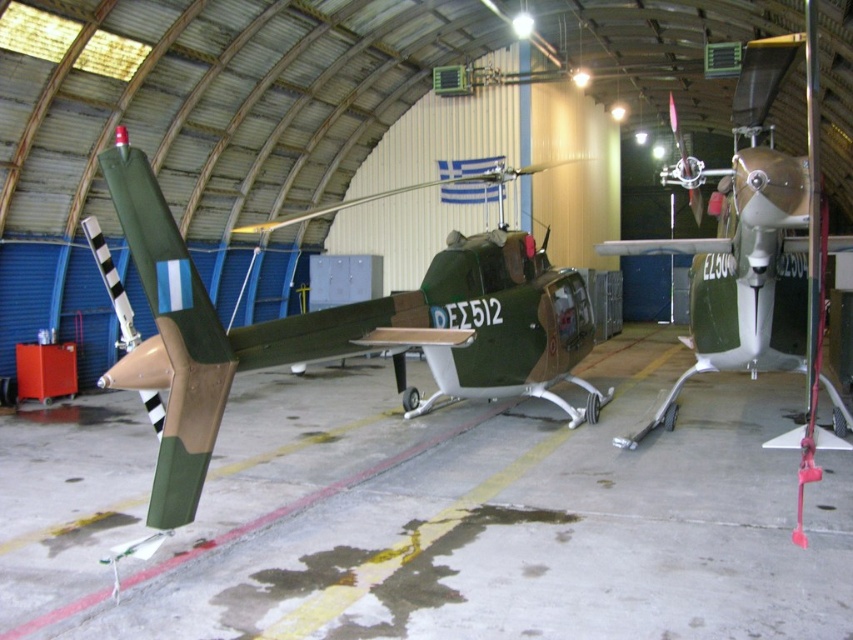
Which of these two, matte green helicopter at center or metallic gold propeller at right, stands taller?

metallic gold propeller at right is taller.

Does point (164, 296) come closer to viewer compared to point (740, 193)?

Yes, point (164, 296) is in front of point (740, 193).

Locate an element on the screen. matte green helicopter at center is located at coordinates (314, 324).

Where is `matte green helicopter at center`? matte green helicopter at center is located at coordinates (314, 324).